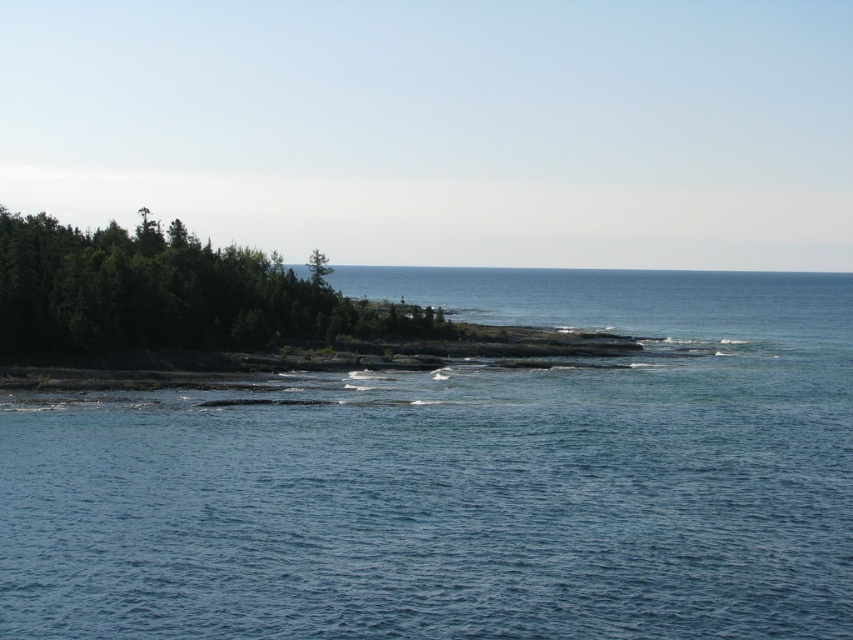
You are standing on the rocky shoreline and want to walk towards the green leafy trees at left from the blue water at center. Which direction should you head?

You should head upwards towards the green leafy trees at left because the blue water at center is located below them.

Looking at this image, you are standing at the origin point in the image. Which direction should you move to reach the blue water at center?

The blue water at center is located at coordinates point (465, 481), so you should move towards the right and slightly forward to reach it.